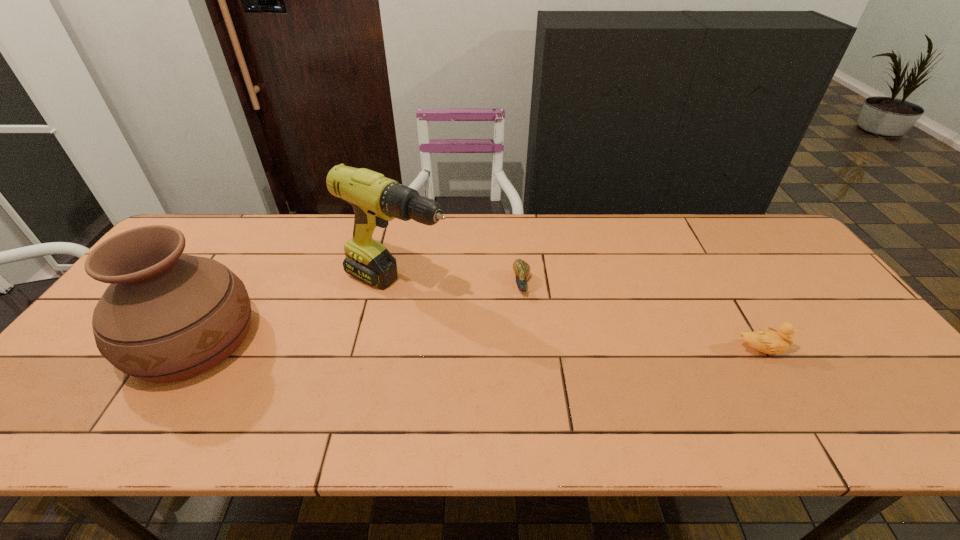
At what (x,y) coordinates should I click in order to perform the action: click on vacant area that lies between the urn and the escargot. Please return your answer as a coordinate pair (x, y). This screenshot has height=540, width=960. Looking at the image, I should click on (357, 313).

Where is `vacant point located between the second object from right to left and the third shortest object`? This screenshot has height=540, width=960. vacant point located between the second object from right to left and the third shortest object is located at coordinates (357, 313).

This screenshot has height=540, width=960. Find the location of `free space between the shortest object and the tallest object`. free space between the shortest object and the tallest object is located at coordinates (460, 286).

This screenshot has width=960, height=540. Identify the location of free space between the rightmost object and the tallest object. (578, 318).

Locate which object is the second closest to the escargot. Please provide its 2D coordinates. Your answer should be formatted as a tuple, i.e. [(x, y)], where the tuple contains the x and y coordinates of a point satisfying the conditions above.

[(769, 341)]

The width and height of the screenshot is (960, 540). Find the location of `object that stands as the second closest to the urn`. object that stands as the second closest to the urn is located at coordinates (521, 268).

Locate an element on the screen. free region that satisfies the following two spatial constraints: 1. on the back side of the third object from left to right; 2. on the left side of the urn is located at coordinates (228, 285).

The image size is (960, 540). Find the location of `vacant region that satisfies the following two spatial constraints: 1. on the front side of the shortest object; 2. on the face of the duckling`. vacant region that satisfies the following two spatial constraints: 1. on the front side of the shortest object; 2. on the face of the duckling is located at coordinates (x=528, y=350).

At what (x,y) coordinates should I click in order to perform the action: click on free point that satisfies the following two spatial constraints: 1. on the front side of the drill; 2. on the face of the duckling. Please return your answer as a coordinate pair (x, y). This screenshot has width=960, height=540. Looking at the image, I should click on click(384, 350).

Where is `free space that satisfies the following two spatial constraints: 1. on the front side of the duckling; 2. on the face of the drill`? The height and width of the screenshot is (540, 960). free space that satisfies the following two spatial constraints: 1. on the front side of the duckling; 2. on the face of the drill is located at coordinates (384, 350).